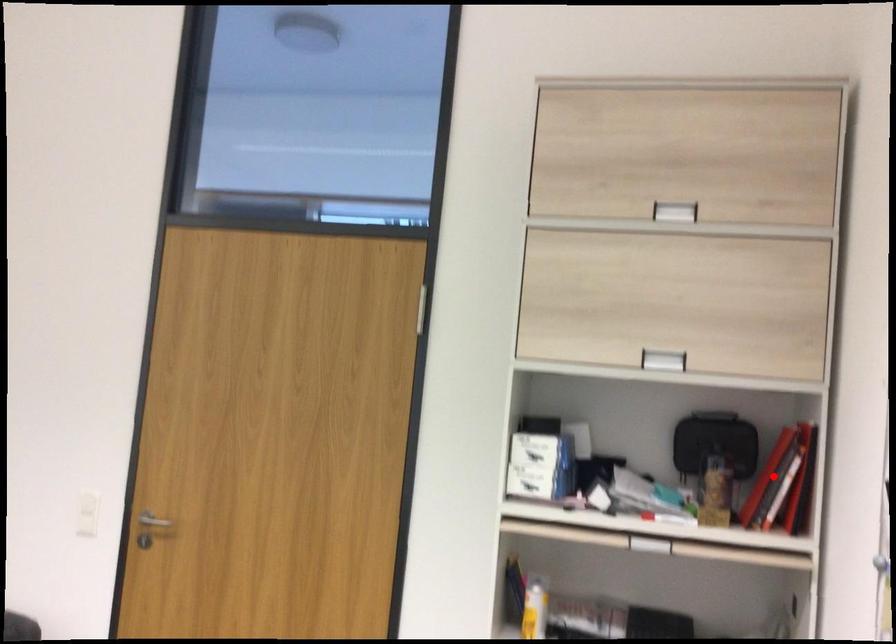
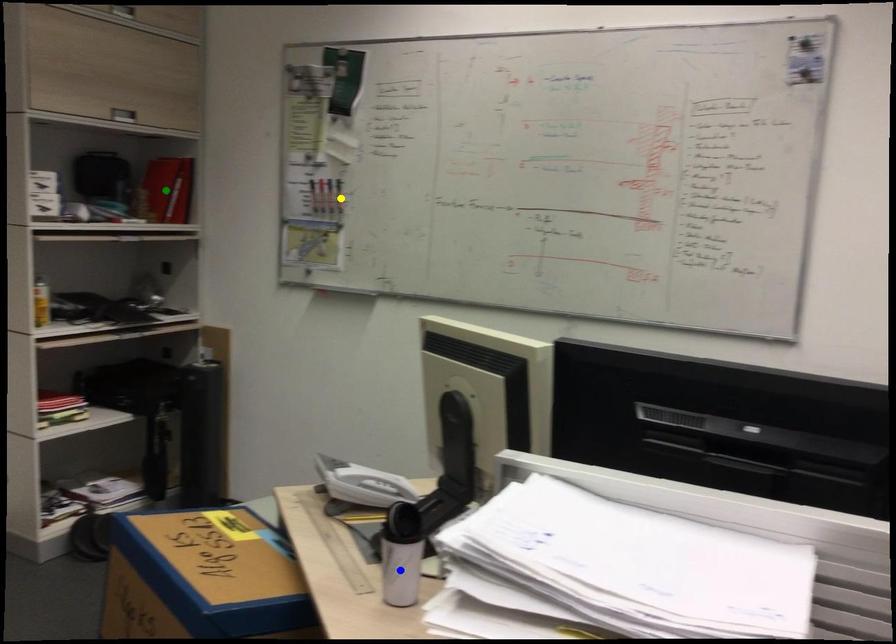
Question: I am providing you with two images of the same scene from different viewpoints. A red point is marked on the first image. You are given multiple points on the second image. In image 2, which mark is for the same physical point as the one in image 1?

Choices:
 (A) green point
 (B) blue point
 (C) yellow point

Answer: (A)